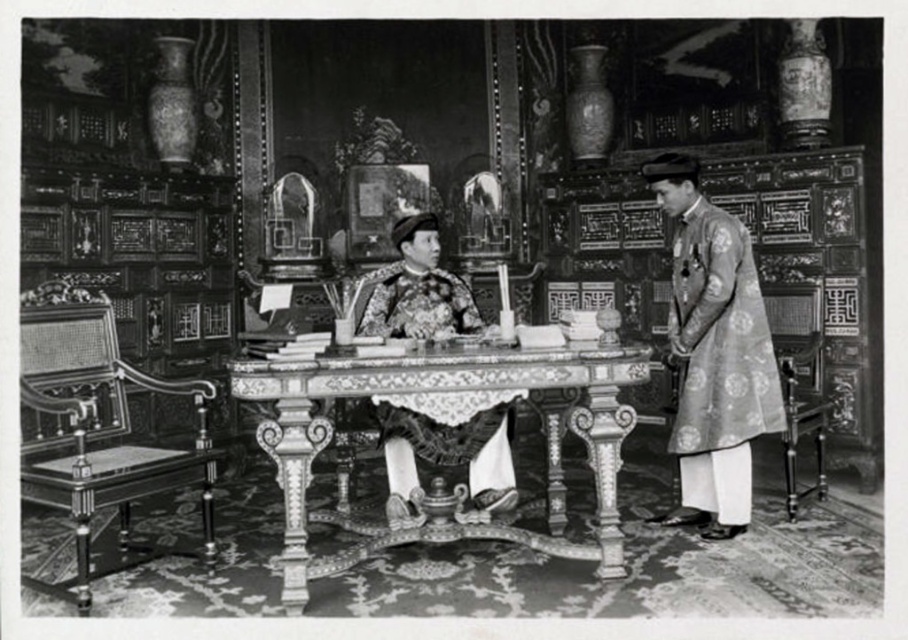
Who is more distant from viewer, (x=777, y=404) or (x=398, y=440)?

Positioned behind is point (x=398, y=440).

Who is lower down, silky brocade robe at right or embroidered silk robe at center?

silky brocade robe at right is lower down.

Between point (739, 440) and point (418, 289), which one is positioned in front?

Point (739, 440)

Where is `silky brocade robe at right`? This screenshot has height=640, width=908. silky brocade robe at right is located at coordinates (718, 362).

Who is more forward, (332, 429) or (364, 320)?

Positioned in front is point (332, 429).

Is decorative wood table at center behind embroidered silk robe at center?

No, decorative wood table at center is in front of embroidered silk robe at center.

Is point (563, 384) farther from viewer compared to point (461, 461)?

No, it is not.

You are a GUI agent. You are given a task and a screenshot of the screen. Output one action in this format:
    pyautogui.click(x=<x>, y=<y>)
    Task: Click on the decorative wood table at center
    Image resolution: width=908 pixels, height=640 pixels.
    Given the screenshot: What is the action you would take?
    pyautogui.click(x=449, y=394)

Is point (600, 486) in front of point (760, 365)?

Yes, point (600, 486) is closer to viewer.

Between decorative wood table at center and silky brocade robe at right, which one has less height?

decorative wood table at center is shorter.

This screenshot has width=908, height=640. Describe the element at coordinates (449, 394) in the screenshot. I see `decorative wood table at center` at that location.

I want to click on decorative wood table at center, so click(x=449, y=394).